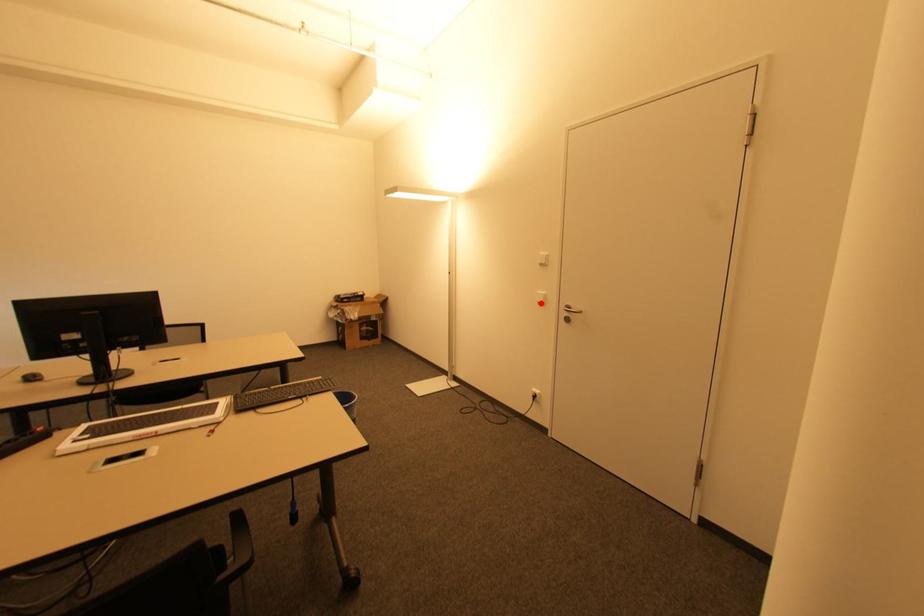
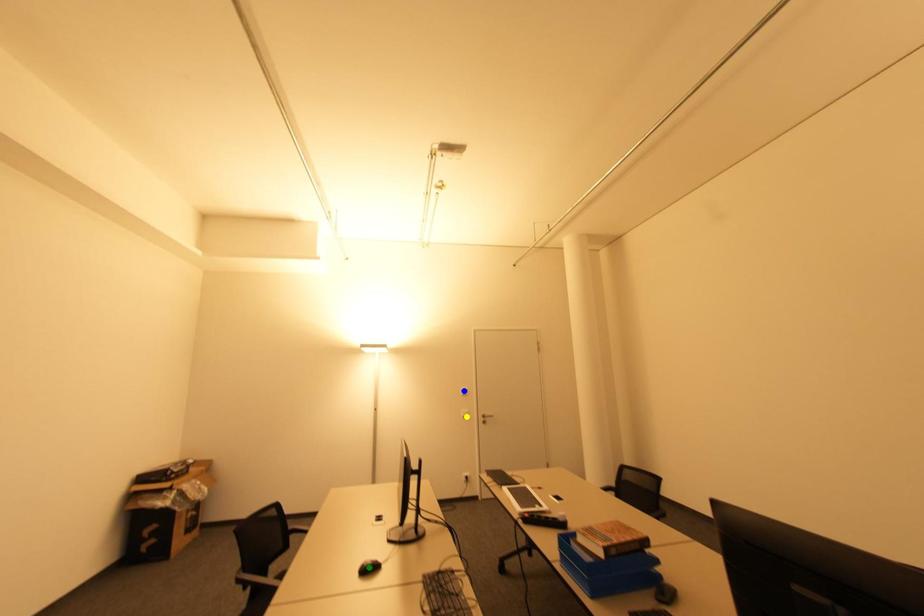
Question: I am providing you with two images of the same scene from different viewpoints. A red point is marked on the first image. You are given multiple points on the second image. Which point in image 2 represents the same 3d spot as the red point in image 1?

Choices:
 (A) blue point
 (B) yellow point
 (C) green point

Answer: (B)